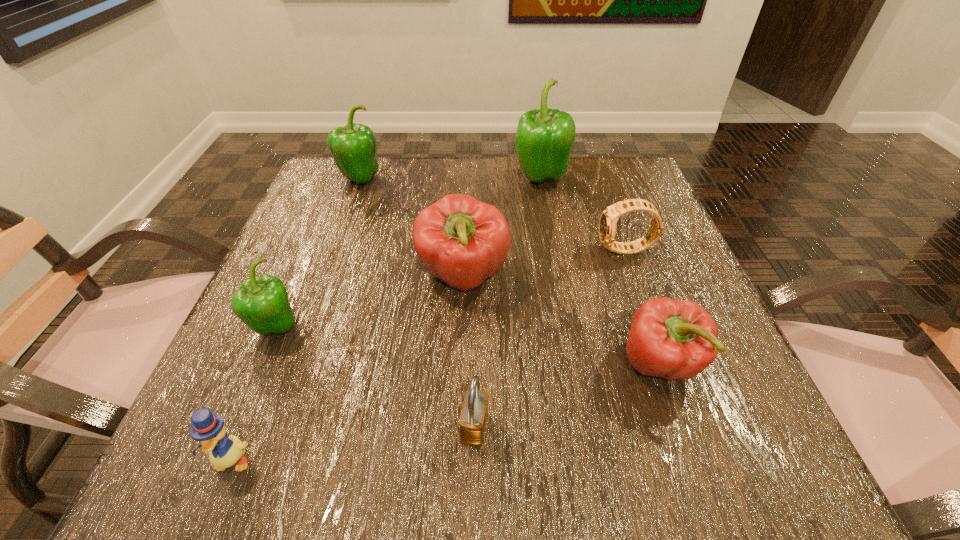
The height and width of the screenshot is (540, 960). Find the location of `yellow duckling`. yellow duckling is located at coordinates (208, 429).

Where is `vacant space located on the left of the biggest green bell pepper`? This screenshot has width=960, height=540. vacant space located on the left of the biggest green bell pepper is located at coordinates (455, 179).

Identify the location of vacant space situated 0.080m on the right of the second smallest green bell pepper. (414, 180).

The height and width of the screenshot is (540, 960). I want to click on vacant space located on the back of the third bell pepper from right to left, so click(466, 214).

Where is `vacant space located on the right of the nearest green bell pepper`? The height and width of the screenshot is (540, 960). vacant space located on the right of the nearest green bell pepper is located at coordinates pos(461,328).

At what (x,y) coordinates should I click in order to perform the action: click on vacant space located 0.390m on the back of the rightmost bell pepper. Please return your answer as a coordinate pair (x, y). This screenshot has height=540, width=960. Looking at the image, I should click on (602, 200).

This screenshot has height=540, width=960. I want to click on free space located on the face of the black watch, so click(468, 251).

The height and width of the screenshot is (540, 960). Find the location of `vacant position located on the face of the black watch`. vacant position located on the face of the black watch is located at coordinates (468, 251).

This screenshot has width=960, height=540. In order to click on free spot located 0.300m on the face of the black watch in this screenshot , I will do `click(448, 251)`.

At what (x,y) coordinates should I click in order to perform the action: click on vacant area situated on the right of the padlock. Please return your answer as a coordinate pair (x, y). Looking at the image, I should click on point(675,428).